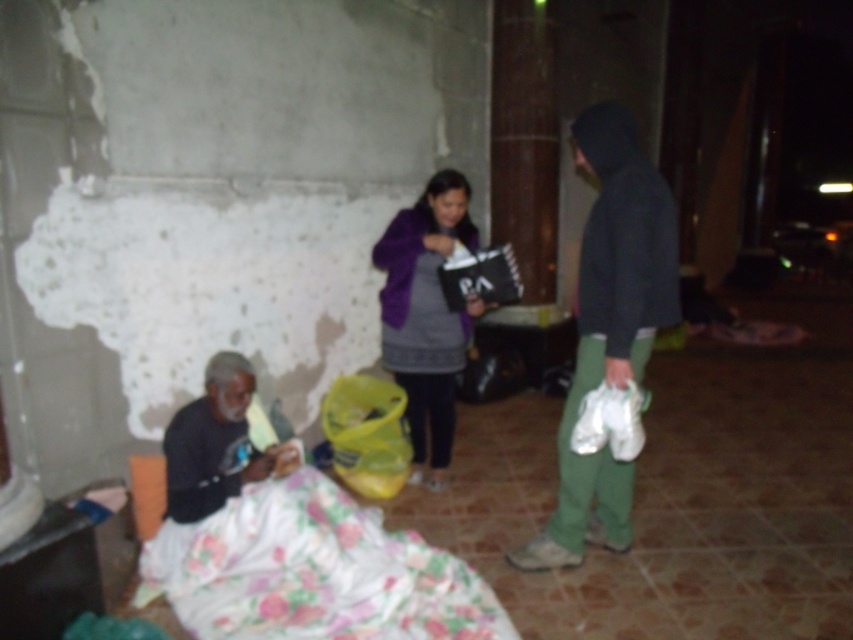
You are a delivery person who needs to place a small package on the floor between the dark gray hoodie at right and the black matte bag at center. Can you fit the package there?

The dark gray hoodie at right might be wider than the black matte bag at center, so there might not be enough space between them to fit the package.

You are a delivery person who needs to place a package on the black matte bag at center. However, there is a dark gray hoodie at right in the way. Can you move the hoodie to access the bag?

The dark gray hoodie at right is in front of the black matte bag at center, so you need to move the hoodie to access the bag.

You are a delivery person who needs to place a purple fleece jacket at center on a table that is 3 meters away from your current position. Is the distance sufficient?

The purple fleece jacket at center is 3.35 meters away from the table, so the distance is sufficient to place it there.